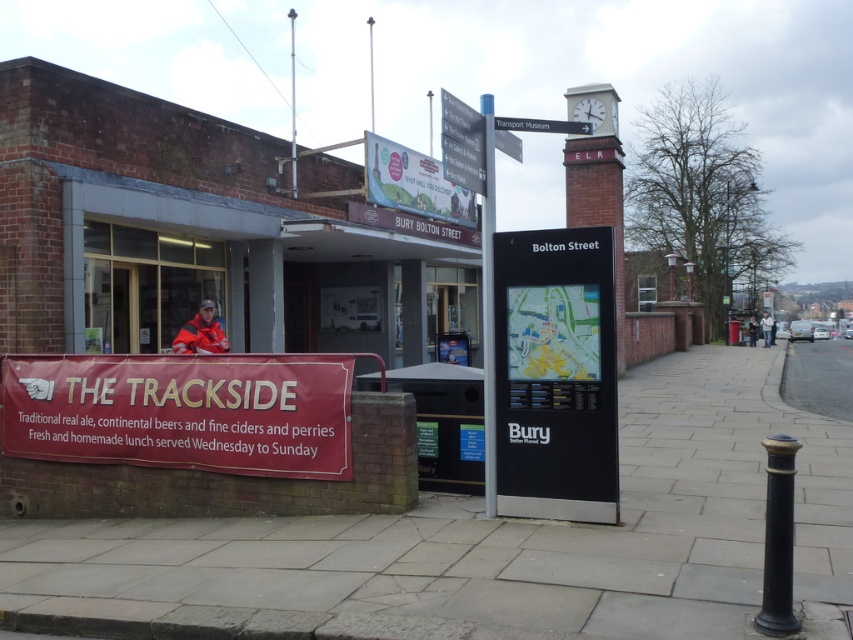
From the picture: You are a person standing at the entrance of the railway station. You see the smooth concrete pavement at lower center and the matte red banner at lower left. Which object is located to the right of the other?

The smooth concrete pavement at lower center is positioned on the right side of matte red banner at lower left, so the smooth concrete pavement at lower center is to the right of the matte red banner at lower left.

You are at the railway station and need to check the black plastic map at center. You see a light brown leather jacket at center. Which direction should you move to reach the map first?

The black plastic map at center is to the left of the light brown leather jacket at center, so you should move to your left to reach the map first.